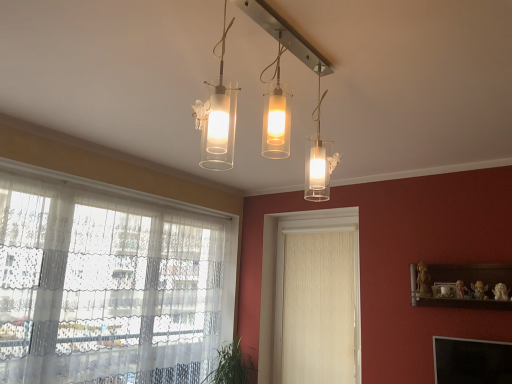
Question: Does point (419, 297) appear closer or farther from the camera than point (165, 304)?

Choices:
 (A) farther
 (B) closer

Answer: (B)

Question: Is wooden shelf at right bigger or smaller than transparent lace curtain at left?

Choices:
 (A) small
 (B) big

Answer: (A)

Question: Estimate the real-world distances between objects in this image. Which object is closer to the clear glass light fixture at center?

Choices:
 (A) transparent lace curtain at left
 (B) green leafy plant at lower left
 (C) wooden shelf at right
 (D) white textured curtain at center

Answer: (C)

Question: Which object is the farthest from the white textured curtain at center?

Choices:
 (A) wooden shelf at right
 (B) transparent lace curtain at left
 (C) green leafy plant at lower left
 (D) clear glass light fixture at center

Answer: (D)